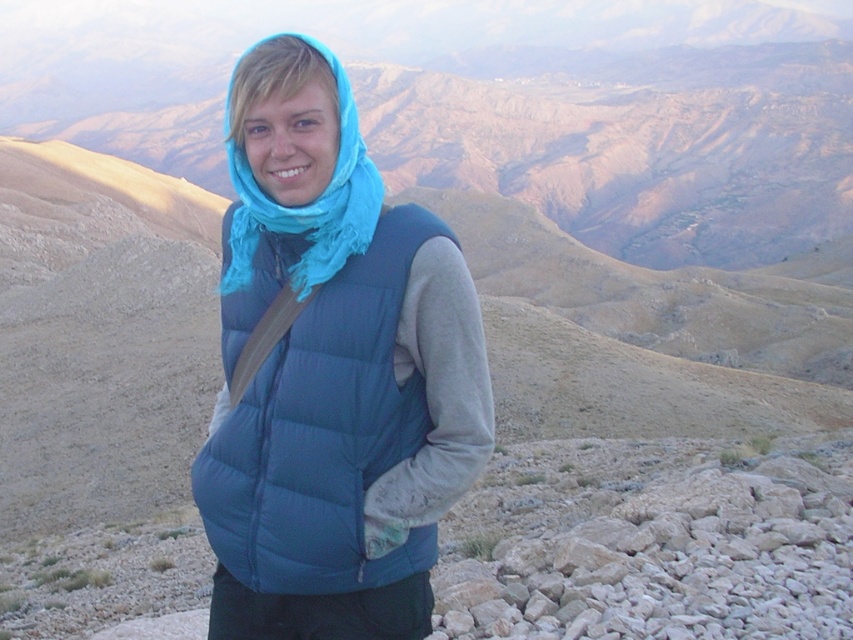
You are a hiker trying to locate your friend who is wearing a matte blue puffer vest at center in a mountainous landscape. If you are standing at the origin point of the coordinate system, where would you find your friend?

Your friend wearing the matte blue puffer vest at center is located at coordinate point (323, 433).

You are a hiker trying to identify your gear in the photo. You see a matte blue puffer vest at center and a turquoise soft scarf at center. Which item is positioned more to the right?

The matte blue puffer vest at center is positioned more to the right than the turquoise soft scarf at center.